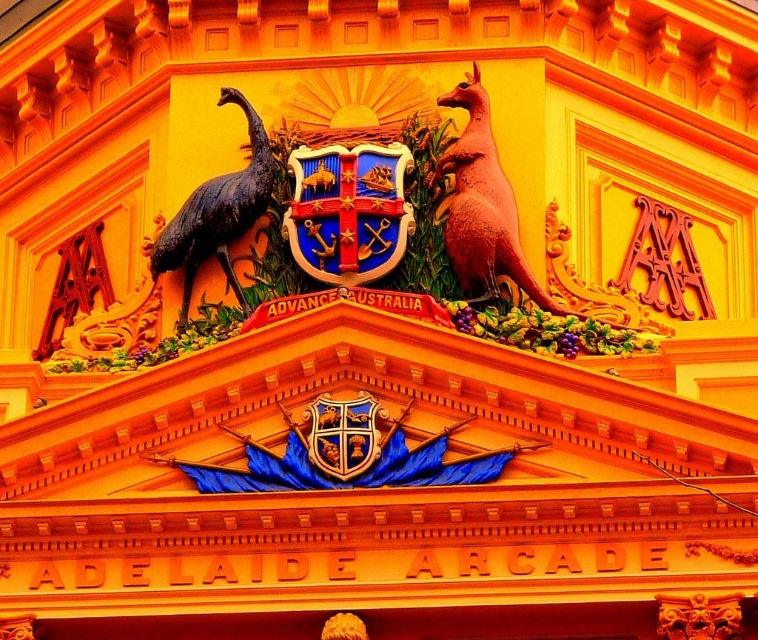
Is rubber-like pink kangaroo at upper right in front of shiny bronze emu at left?

Yes, it is.

Which is more to the left, rubber-like pink kangaroo at upper right or shiny bronze emu at left?

Positioned to the left is shiny bronze emu at left.

Where is `rubber-like pink kangaroo at upper right`? The height and width of the screenshot is (640, 758). rubber-like pink kangaroo at upper right is located at coordinates (481, 205).